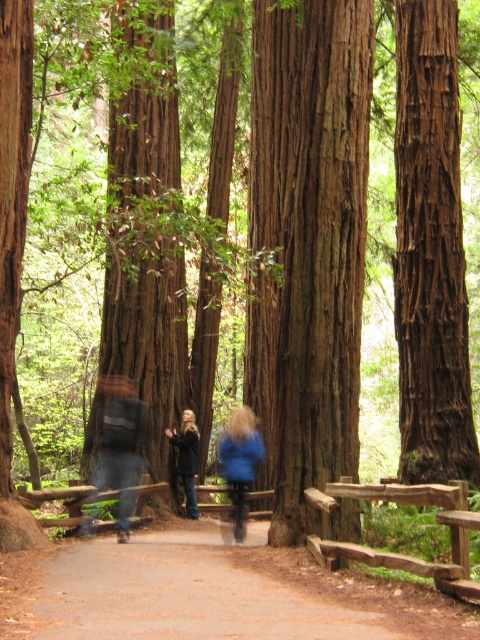
Does blue wool coat at center appear on the right side of dark blue jeans at center?

No, blue wool coat at center is not to the right of dark blue jeans at center.

Is blue wool coat at center taller than dark blue jeans at center?

Correct, blue wool coat at center is much taller as dark blue jeans at center.

Which is behind, point (142, 458) or point (132, 438)?

Point (142, 458)

Identify the location of blue wool coat at center. (117, 444).

Who is taller, brown rough bark tree at right or dark blue jeans at center?

brown rough bark tree at right

Can you confirm if brown rough bark tree at right is bigger than dark blue jeans at center?

Yes.

What do you see at coordinates (431, 250) in the screenshot? I see `brown rough bark tree at right` at bounding box center [431, 250].

Where is `brown rough bark tree at right`? brown rough bark tree at right is located at coordinates (431, 250).

Identify the location of smooth brown tree trunk at center. This screenshot has width=480, height=640. (308, 241).

Between point (271, 400) and point (450, 184), which one is positioned behind?

The point (271, 400) is behind.

Between point (336, 396) and point (423, 156), which one is positioned behind?

Positioned behind is point (423, 156).

Locate an element on the screen. This screenshot has height=640, width=480. smooth brown tree trunk at center is located at coordinates (308, 241).